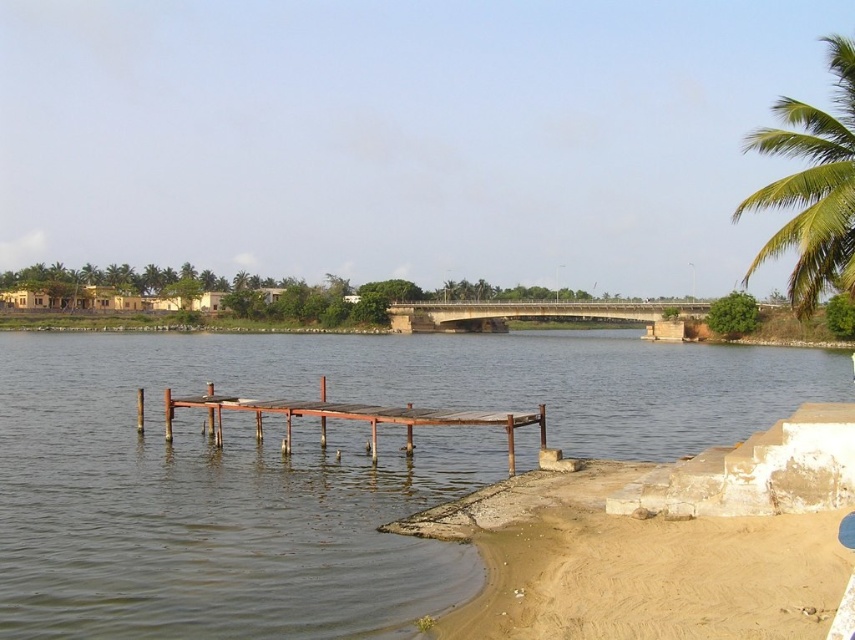
Does brown wooden dock at center have a smaller size compared to brown sandy beach at lower right?

Incorrect, brown wooden dock at center is not smaller in size than brown sandy beach at lower right.

In the scene shown: Can you confirm if brown wooden dock at center is wider than brown sandy beach at lower right?

Yes.

Between point (40, 412) and point (684, 588), which one is positioned behind?

Point (40, 412)

Identify the location of brown wooden dock at center. (315, 467).

Who is lower down, brown sandy beach at lower right or rusty wood dock at center?

brown sandy beach at lower right

Which is in front, point (594, 614) or point (287, 451)?

Point (594, 614) is more forward.

Is point (581, 595) closer to camera compared to point (286, 452)?

That is True.

This screenshot has width=855, height=640. What are the coordinates of `brown sandy beach at lower right` in the screenshot? It's located at (632, 564).

Is green leafy palm tree at upper right taller than rusty wood dock at center?

Indeed, green leafy palm tree at upper right has a greater height compared to rusty wood dock at center.

Is point (838, 225) behind point (405, 445)?

That is False.

Where is `green leafy palm tree at upper right`? The height and width of the screenshot is (640, 855). green leafy palm tree at upper right is located at coordinates (812, 188).